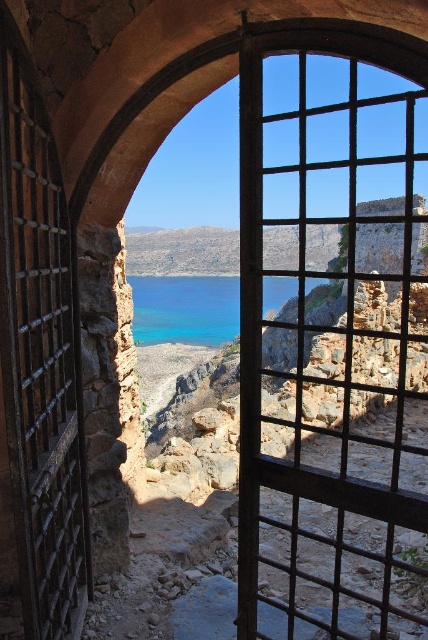
Question: Is metallic grid window at center above blue crystal water at center?

Choices:
 (A) no
 (B) yes

Answer: (B)

Question: Does metallic grid window at center appear on the right side of blue crystal water at center?

Choices:
 (A) yes
 (B) no

Answer: (A)

Question: Which point is farther from the camera taking this photo?

Choices:
 (A) (208, 316)
 (B) (407, 314)

Answer: (A)

Question: Which of the following is the farthest from the observer?

Choices:
 (A) metallic grid window at center
 (B) blue crystal water at center

Answer: (B)

Question: Does metallic grid window at center come behind blue crystal water at center?

Choices:
 (A) no
 (B) yes

Answer: (A)